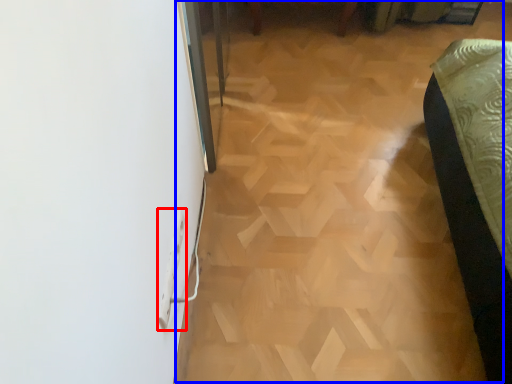
Question: Which object appears closest to the camera in this image, electric outlet (highlighted by a red box) or plywood (highlighted by a blue box)?

Choices:
 (A) electric outlet
 (B) plywood

Answer: (A)